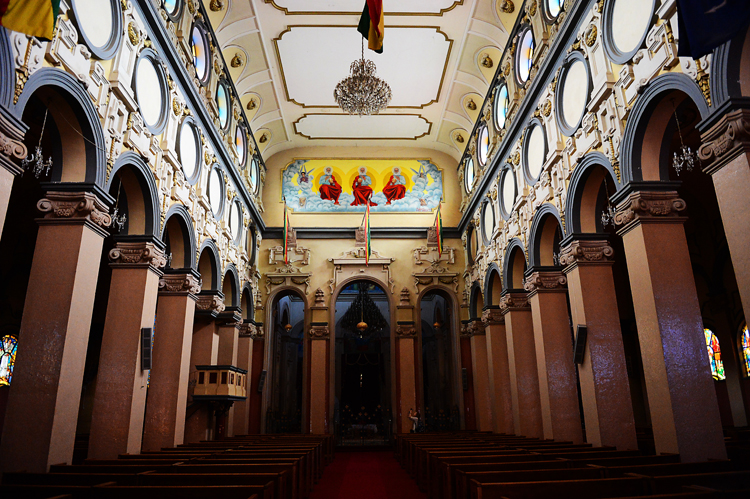
Image resolution: width=750 pixels, height=499 pixels. Identify the location of floor. (357, 474).